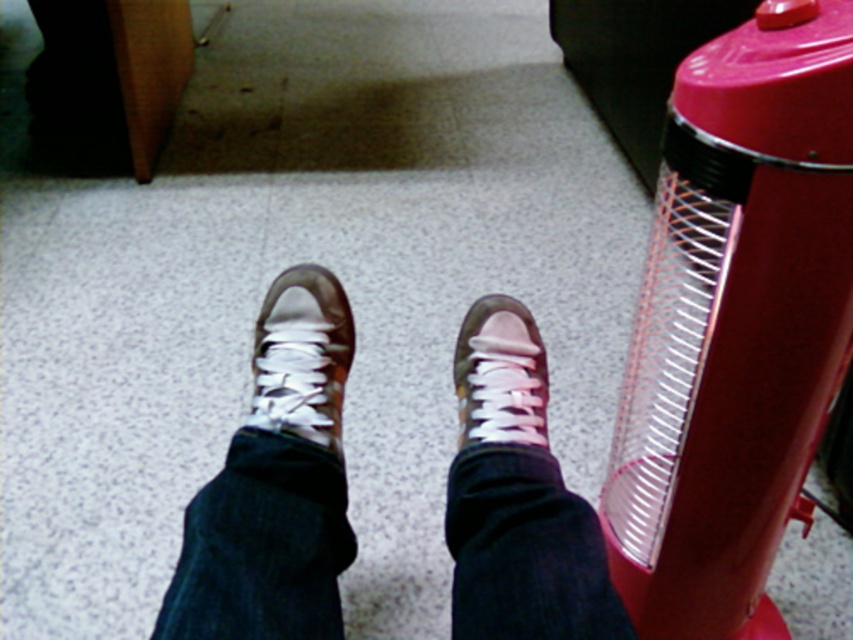
Is matte brown sneakers at center wider than white matte shoe at center?

Correct, the width of matte brown sneakers at center exceeds that of white matte shoe at center.

Does matte brown sneakers at center lie behind white matte shoe at center?

That is False.

Does point (286, 460) lie in front of point (465, 355)?

Yes, point (286, 460) is in front of point (465, 355).

At what (x,y) coordinates should I click in order to perform the action: click on matte brown sneakers at center. Please return your answer as a coordinate pair (x, y). Looking at the image, I should click on (x=276, y=484).

From the picture: Which of these two, matte brown sneakers at center or white leather shoe at center, stands taller?

Standing taller between the two is matte brown sneakers at center.

Is matte brown sneakers at center above white leather shoe at center?

Incorrect, matte brown sneakers at center is not positioned above white leather shoe at center.

Is point (299, 538) positioned before point (341, 356)?

Yes.

At what (x,y) coordinates should I click in order to perform the action: click on matte brown sneakers at center. Please return your answer as a coordinate pair (x, y). Looking at the image, I should click on (276, 484).

Does white leather shoe at center appear on the right side of white matte shoe at center?

In fact, white leather shoe at center is to the left of white matte shoe at center.

Who is taller, white leather shoe at center or white matte shoe at center?

white leather shoe at center is taller.

Identify the location of white leather shoe at center. (302, 356).